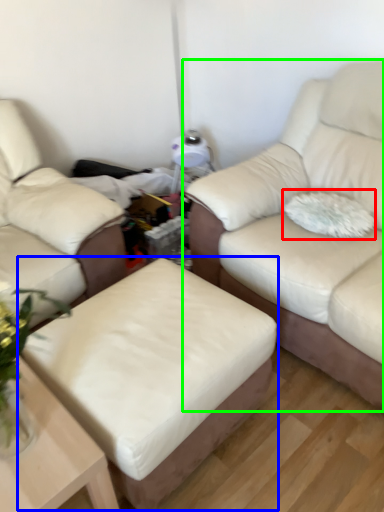
Question: Which object is the closest to the pillow (highlighted by a red box)? Choose among these: stool (highlighted by a blue box) or studio couch (highlighted by a green box).

Choices:
 (A) stool
 (B) studio couch

Answer: (B)